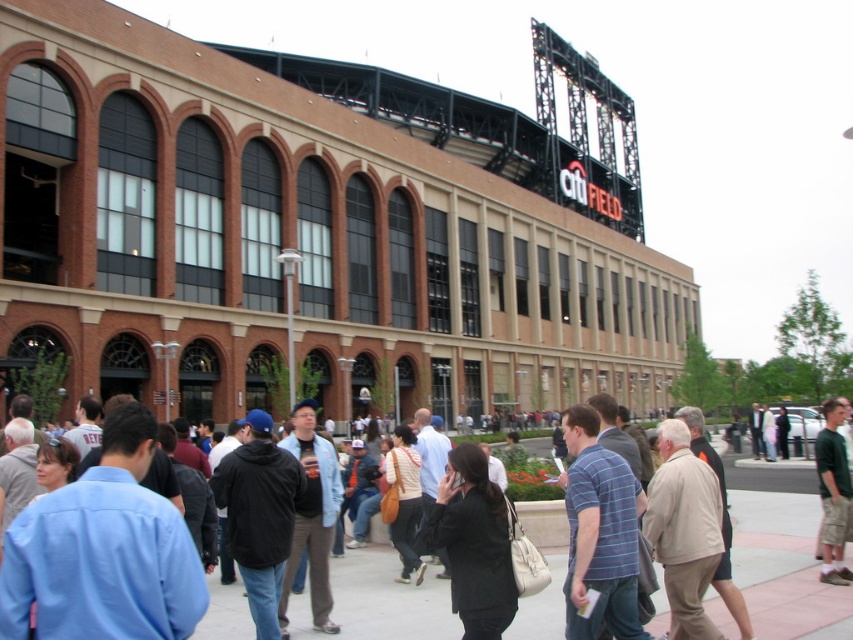
Question: Can you confirm if brown brick building at center is positioned to the right of green cotton shirt at right?

Choices:
 (A) no
 (B) yes

Answer: (A)

Question: In this image, where is brown brick building at center located relative to green cotton shirt at right?

Choices:
 (A) above
 (B) below

Answer: (A)

Question: Does brown brick building at center have a smaller size compared to green cotton shirt at right?

Choices:
 (A) no
 (B) yes

Answer: (A)

Question: Which point is farther to the camera?

Choices:
 (A) (225, 252)
 (B) (833, 461)

Answer: (A)

Question: Which object is farther from the camera taking this photo?

Choices:
 (A) green cotton shirt at right
 (B) brown brick building at center

Answer: (B)